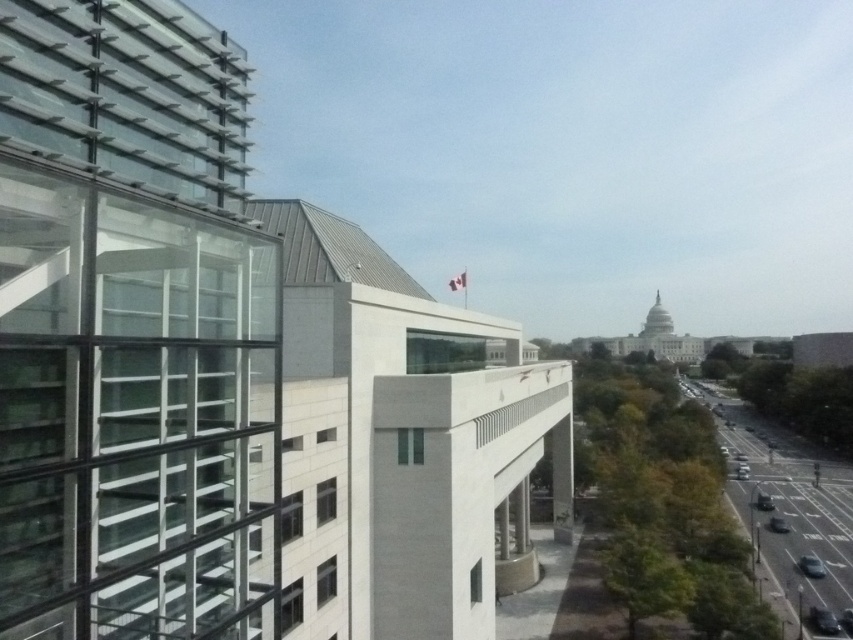
You are a pedestrian standing at the flagpole with the Canadian flag. You want to walk to the shiny silver car at lower right. Which direction should you walk to avoid the shiny black car at center?

The shiny black car at center is behind the shiny silver car at lower right, so to avoid it, you should walk directly towards the shiny silver car at lower right without needing to detour, as the shiny black car is positioned behind it and out of your path.